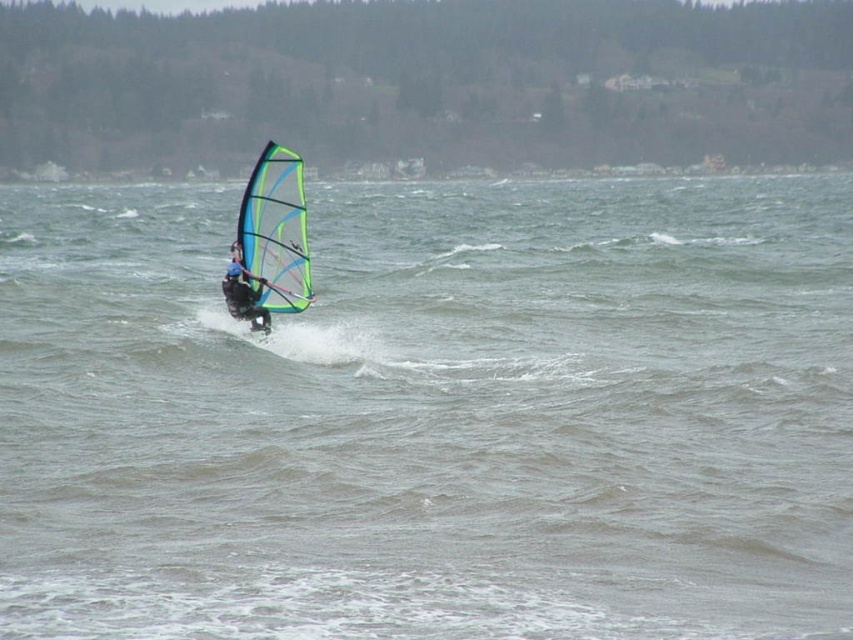
Measure the distance between point (x=247, y=252) and camera.

A distance of 69.32 feet exists between point (x=247, y=252) and camera.

Does translucent blue-green sail at center have a lesser height compared to blue matte windsurfer at center?

Incorrect, translucent blue-green sail at center's height does not fall short of blue matte windsurfer at center's.

The height and width of the screenshot is (640, 853). I want to click on translucent blue-green sail at center, so click(276, 228).

What are the coordinates of `translucent blue-green sail at center` in the screenshot? It's located at (276, 228).

In the scene shown: Who is positioned more to the left, clear water at center or translucent blue-green sail at center?

Positioned to the left is translucent blue-green sail at center.

Is clear water at center bigger than translucent blue-green sail at center?

Indeed, clear water at center has a larger size compared to translucent blue-green sail at center.

Is point (700, 230) positioned after point (287, 296)?

Yes.

At what (x,y) coordinates should I click in order to perform the action: click on clear water at center. Please return your answer as a coordinate pair (x, y). Looking at the image, I should click on (432, 413).

Consider the image. How much distance is there between clear water at center and blue matte windsurfer at center?

clear water at center is 9.70 meters away from blue matte windsurfer at center.

Is the position of clear water at center more distant than that of blue matte windsurfer at center?

No, it is in front of blue matte windsurfer at center.

Between point (262, 536) and point (241, 289), which one is positioned behind?

Positioned behind is point (241, 289).

Where is `clear water at center`? Image resolution: width=853 pixels, height=640 pixels. clear water at center is located at coordinates (432, 413).